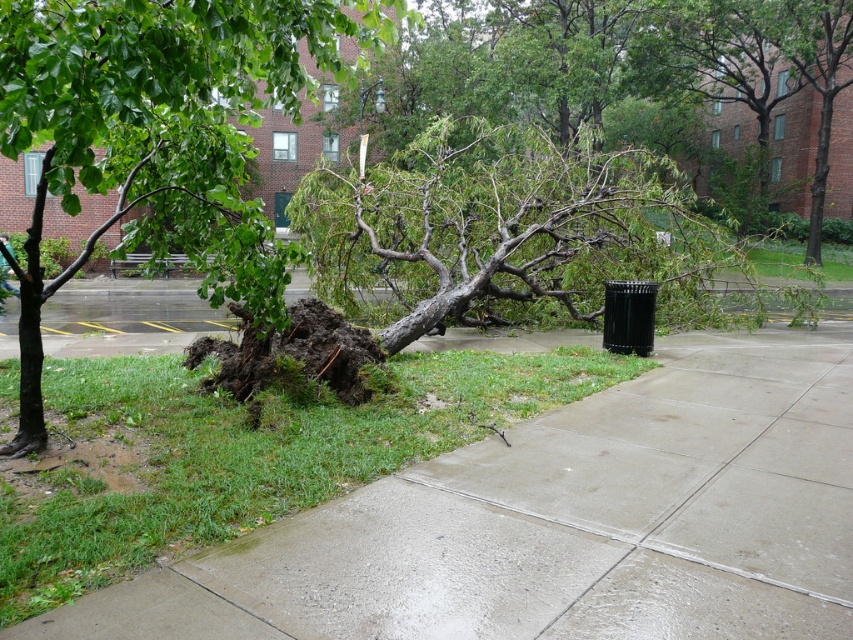
In the scene shown: Who is shorter, concrete at center or green leafy tree at left?

concrete at center is shorter.

How much distance is there between concrete at center and green leafy tree at left?

concrete at center is 7.17 meters away from green leafy tree at left.

Who is more distant from viewer, (521, 588) or (271, 17)?

The point (271, 17) is more distant.

Locate an element on the screen. The image size is (853, 640). concrete at center is located at coordinates (561, 522).